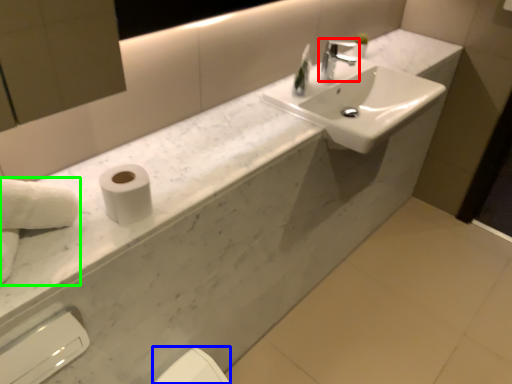
Question: Considering the real-world distances, which object is farthest from tap (highlighted by a red box)? bidet (highlighted by a blue box) or hand towel (highlighted by a green box)?

Choices:
 (A) bidet
 (B) hand towel

Answer: (B)